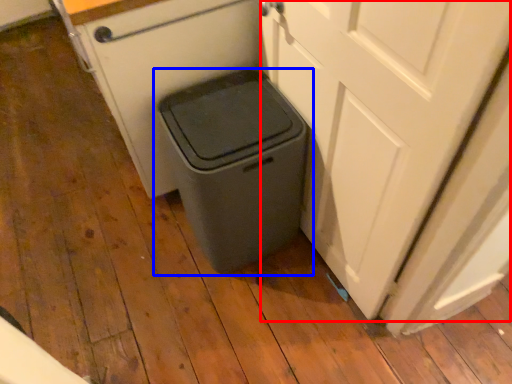
Question: Which point is closer to the camera, screen door (highlighted by a red box) or waste container (highlighted by a blue box)?

Choices:
 (A) screen door
 (B) waste container

Answer: (A)